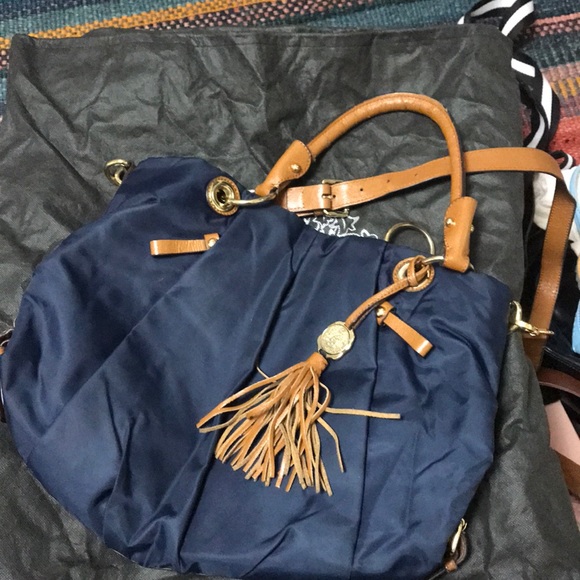
This screenshot has width=580, height=580. I want to click on woven rug, so click(333, 10).